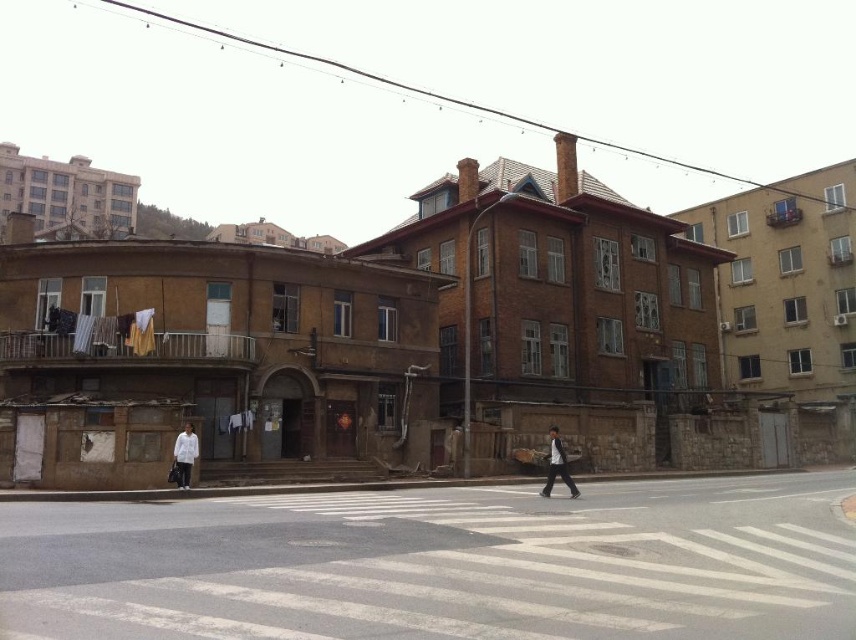
Who is higher up, white asphalt crosswalk at center or dark gray suit at center?

Positioned higher is white asphalt crosswalk at center.

Does point (733, 634) lie in front of point (559, 445)?

Yes.

This screenshot has width=856, height=640. I want to click on white asphalt crosswalk at center, so click(441, 564).

Is white matte jacket at lower left below dark gray suit at center?

Incorrect, white matte jacket at lower left is not positioned below dark gray suit at center.

Does point (187, 486) lie in front of point (562, 461)?

No.

Who is more forward, [187,429] or [557,468]?

Positioned in front is point [557,468].

This screenshot has height=640, width=856. In order to click on white matte jacket at lower left in this screenshot , I will do `click(183, 456)`.

Which is behind, point (34, 584) or point (177, 477)?

Point (177, 477)

Which of these two, white asphalt crosswalk at center or white matte jacket at lower left, stands shorter?

With less height is white matte jacket at lower left.

Who is more forward, (372,508) or (194,460)?

Point (372,508) is more forward.

The height and width of the screenshot is (640, 856). In order to click on white asphalt crosswalk at center in this screenshot , I will do `click(441, 564)`.